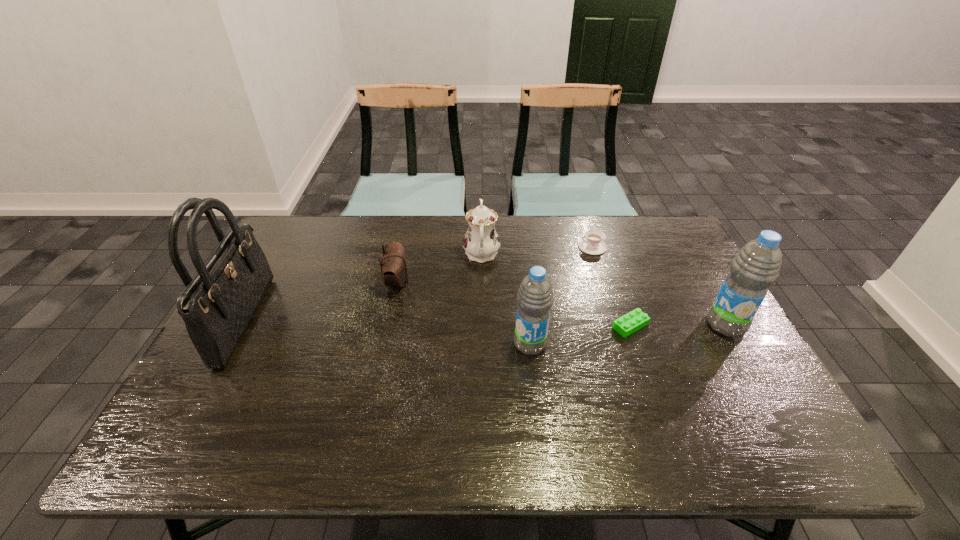
The width and height of the screenshot is (960, 540). In order to click on blank area in the image that satisfies the following two spatial constraints: 1. with the flap open on the fourth object from right to left; 2. on the left side of the second object from left to right in this screenshot , I will do `click(384, 344)`.

The height and width of the screenshot is (540, 960). Identify the location of vacant area in the image that satisfies the following two spatial constraints: 1. on the handle side of the sixth shortest object; 2. on the right side of the sixth tallest object. (617, 325).

You are a GUI agent. You are given a task and a screenshot of the screen. Output one action in this format:
    pyautogui.click(x=<x>, y=<y>)
    Task: Click on the free space that satisfies the following two spatial constraints: 1. with the flap open on the fourth object from left to right; 2. on the right side of the sixth object from right to left
    The width and height of the screenshot is (960, 540).
    Given the screenshot: What is the action you would take?
    pyautogui.click(x=384, y=344)

At what (x,y) coordinates should I click in order to perform the action: click on free point that satisfies the following two spatial constraints: 1. with an open clasp on the front of the shortest object; 2. on the left side of the handbag. Please return your answer as a coordinate pair (x, y). Looking at the image, I should click on (242, 326).

You are a GUI agent. You are given a task and a screenshot of the screen. Output one action in this format:
    pyautogui.click(x=<x>, y=<y>)
    Task: Click on the vacant area in the image that satisfies the following two spatial constraints: 1. on the back side of the shortest object; 2. on the handle side of the second shortest object
    The image size is (960, 540).
    Given the screenshot: What is the action you would take?
    pyautogui.click(x=603, y=247)